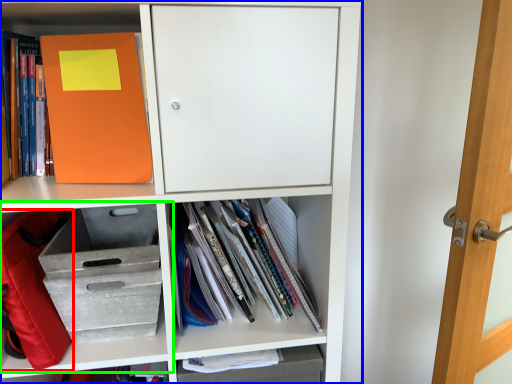
Question: Which object is the farthest from backpack (highlighted by a red box)? Choose among these: shelf (highlighted by a blue box) or shelf (highlighted by a green box).

Choices:
 (A) shelf
 (B) shelf

Answer: (A)